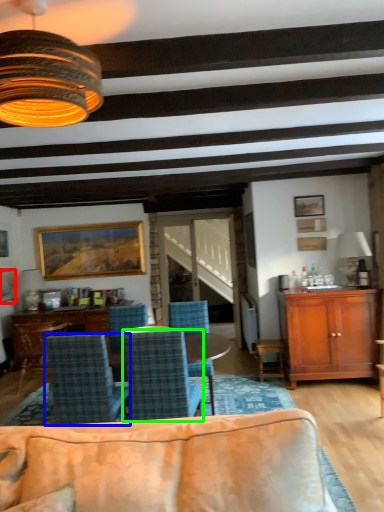
Question: Estimate the real-world distances between objects in this image. Which object is closer to picture frame (highlighted by a red box), chair (highlighted by a blue box) or chair (highlighted by a green box)?

Choices:
 (A) chair
 (B) chair

Answer: (A)